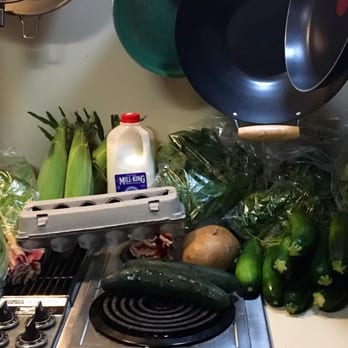
Where is `frying pan`? The height and width of the screenshot is (348, 348). frying pan is located at coordinates (263, 95).